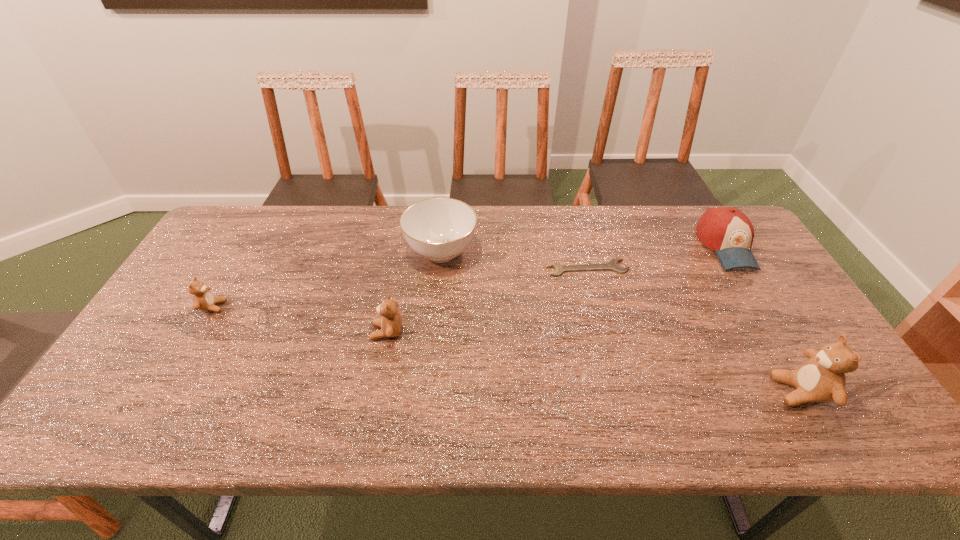
Where is `vacant area at the right edge of the desktop`? Image resolution: width=960 pixels, height=540 pixels. vacant area at the right edge of the desktop is located at coordinates (766, 284).

Identify the location of free space at the far right corner of the desktop. This screenshot has width=960, height=540. (707, 207).

Where is `free space between the baseball cap and the tallest teddy bear`? The width and height of the screenshot is (960, 540). free space between the baseball cap and the tallest teddy bear is located at coordinates 762,319.

Where is `vacant space that's between the shortest teddy bear and the fourth object from left to right`? vacant space that's between the shortest teddy bear and the fourth object from left to right is located at coordinates (400, 287).

Where is `empty location between the chinaware and the wrench`? This screenshot has height=540, width=960. empty location between the chinaware and the wrench is located at coordinates (515, 260).

Locate an element on the screen. unoccupied area between the leftmost teddy bear and the tallest object is located at coordinates (506, 349).

Locate an element on the screen. The image size is (960, 540). free spot between the baseball cap and the chinaware is located at coordinates (584, 249).

Where is `free space between the second shortest teddy bear and the rightmost teddy bear`? This screenshot has width=960, height=540. free space between the second shortest teddy bear and the rightmost teddy bear is located at coordinates (593, 361).

In order to click on free space between the nearest object and the chinaware in this screenshot , I will do `click(620, 321)`.

Locate an element on the screen. free space between the chinaware and the tallest teddy bear is located at coordinates (620, 321).